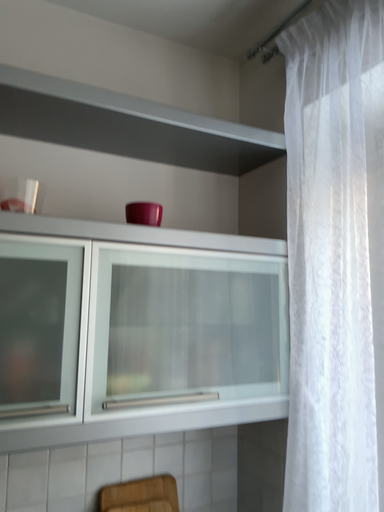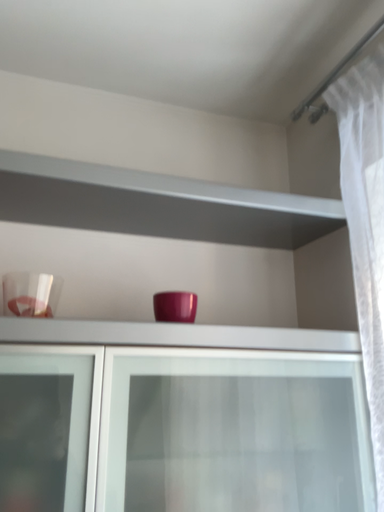
Question: How did the camera likely rotate when shooting the video?

Choices:
 (A) rotated upward
 (B) rotated downward

Answer: (A)